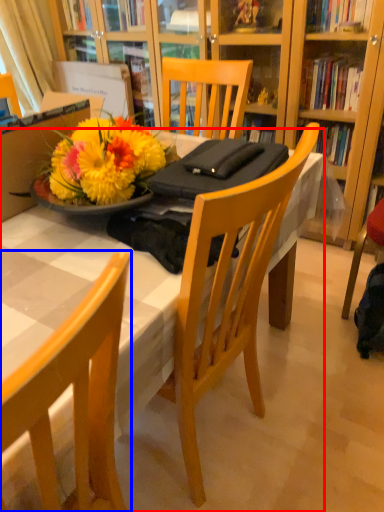
Question: Which of the following is the closest to the observer, desk (highlighted by a red box) or chair (highlighted by a blue box)?

Choices:
 (A) desk
 (B) chair

Answer: (B)